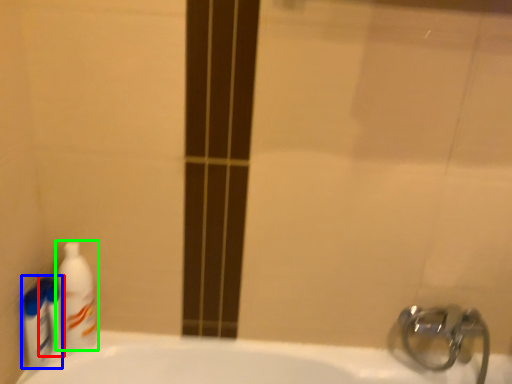
Question: Estimate the real-world distances between objects in this image. Which object is closer to mouthwash (highlighted by a red box), cleaning product (highlighted by a blue box) or cleaning product (highlighted by a green box)?

Choices:
 (A) cleaning product
 (B) cleaning product

Answer: (A)